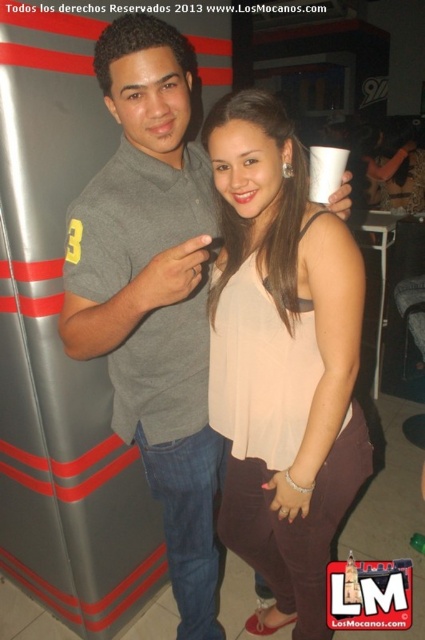
You are a photographer trying to capture a clear shot of the gray cotton polo shirt at center and the white paper cup at center. Based on their positions, which object is closer to the camera?

The white paper cup at center is closer to the camera because the gray cotton polo shirt at center is positioned under it, indicating it is behind the cup in the visual plane.

You are a photographer adjusting your camera settings to focus on the matte beige blouse at center and the gray cotton polo shirt at center. Which of these two items is closer to you?

The matte beige blouse at center is closer to you because it is positioned further to the viewer compared to the gray cotton polo shirt at center.

You are a photographer trying to focus on the gray cotton polo shirt at center and the white paper cup at center in the image. Which object should you adjust your camera focus to first if you want to capture both clearly in the same frame?

The gray cotton polo shirt at center has a larger size compared to the white paper cup at center, so you should focus on the gray cotton polo shirt at center first to ensure its details are sharp before adjusting for the smaller white paper cup at center.